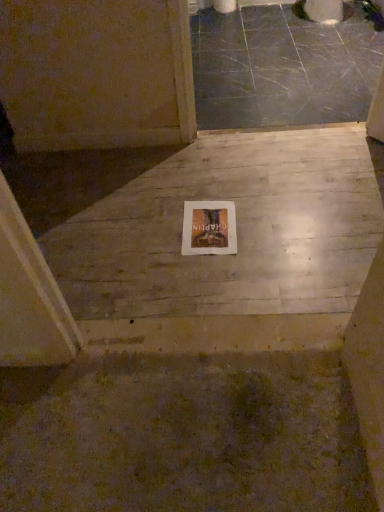
This screenshot has width=384, height=512. What are the coordinates of `white wood floor at center, positioned as the 2th concrete in top-to-bottom order` in the screenshot? It's located at (227, 255).

Identify the location of wooden book at center. (209, 228).

Which object is closer to the camera, wooden book at center or white wood floor at center, which is the 2th concrete from back to front?

white wood floor at center, which is the 2th concrete from back to front, is in front.

Considering the relative sizes of wooden book at center and white wood floor at center, the first concrete from the bottom, in the image provided, is wooden book at center smaller than white wood floor at center, the first concrete from the bottom,?

Yes, wooden book at center is smaller than white wood floor at center, the first concrete from the bottom.

Based on the photo, are wooden book at center and white wood floor at center, the first concrete from the bottom, located far from each other?

No, wooden book at center is in close proximity to white wood floor at center, the first concrete from the bottom.

Considering the relative sizes of wooden book at center and white wood floor at center, the first concrete from the bottom, in the image provided, is wooden book at center shorter than white wood floor at center, the first concrete from the bottom,?

Yes.

Is white wood floor at center, which is the 2th concrete from back to front, to the right of gray polished concrete at upper center, which is counted as the first concrete, starting from the top, from the viewer's perspective?

In fact, white wood floor at center, which is the 2th concrete from back to front, is to the left of gray polished concrete at upper center, which is counted as the first concrete, starting from the top.

Who is shorter, white wood floor at center, which is the first concrete from front to back, or gray polished concrete at upper center, the 2th concrete when ordered from bottom to top?

Standing shorter between the two is gray polished concrete at upper center, the 2th concrete when ordered from bottom to top.

Looking at this image, are wooden book at center and gray polished concrete at upper center, which is counted as the 2th concrete, starting from the front, making contact?

No.

Find the location of a particular element. concrete above the wooden book at center (from a real-world perspective) is located at coordinates (282, 67).

Considering the points (214, 239) and (216, 74), which point is in front, point (214, 239) or point (216, 74)?

The point (214, 239) is closer to the camera.

Could you tell me if gray polished concrete at upper center, which is counted as the 2th concrete, starting from the front, is facing white wood floor at center, positioned as the 2th concrete in top-to-bottom order?

No, gray polished concrete at upper center, which is counted as the 2th concrete, starting from the front, is not aimed at white wood floor at center, positioned as the 2th concrete in top-to-bottom order.

Is gray polished concrete at upper center, the 1th concrete from the back, completely or partially outside of white wood floor at center, the first concrete from the bottom?

gray polished concrete at upper center, the 1th concrete from the back, is positioned outside white wood floor at center, the first concrete from the bottom.

Considering the positions of objects gray polished concrete at upper center, the 2th concrete when ordered from bottom to top, and white wood floor at center, the first concrete from the bottom, in the image provided, who is more to the right, gray polished concrete at upper center, the 2th concrete when ordered from bottom to top, or white wood floor at center, the first concrete from the bottom,?

Positioned to the right is gray polished concrete at upper center, the 2th concrete when ordered from bottom to top.

Is white wood floor at center, which is the first concrete from front to back, next to wooden book at center?

There is a gap between white wood floor at center, which is the first concrete from front to back, and wooden book at center.

In the scene shown: Between white wood floor at center, the first concrete from the bottom, and wooden book at center, which one has smaller width?

With smaller width is wooden book at center.

Is wooden book at center located within white wood floor at center, which is the first concrete from front to back?

Yes, wooden book at center is surrounded by white wood floor at center, which is the first concrete from front to back.

Would you say white wood floor at center, which is the 2th concrete from back to front, is to the left or to the right of wooden book at center in the picture?

white wood floor at center, which is the 2th concrete from back to front, is to the left of wooden book at center.

Does gray polished concrete at upper center, the 1th concrete from the back, have a greater height compared to wooden book at center?

Yes.

Considering the sizes of gray polished concrete at upper center, the 1th concrete from the back, and wooden book at center in the image, is gray polished concrete at upper center, the 1th concrete from the back, wider or thinner than wooden book at center?

Considering their sizes, gray polished concrete at upper center, the 1th concrete from the back, looks broader than wooden book at center.

Is gray polished concrete at upper center, the 1th concrete from the back, oriented towards wooden book at center?

Yes, gray polished concrete at upper center, the 1th concrete from the back, is facing wooden book at center.

Find the location of a particular element. picture frame located behind the white wood floor at center, which is the 2th concrete from back to front is located at coordinates (209, 228).

Where is `concrete on the left of gray polished concrete at upper center, which is counted as the 2th concrete, starting from the front`? concrete on the left of gray polished concrete at upper center, which is counted as the 2th concrete, starting from the front is located at coordinates (227, 255).

Based on their spatial positions, is white wood floor at center, positioned as the 2th concrete in top-to-bottom order, or wooden book at center closer to gray polished concrete at upper center, the 1th concrete from the back?

The object closer to gray polished concrete at upper center, the 1th concrete from the back, is white wood floor at center, positioned as the 2th concrete in top-to-bottom order.

Which object lies nearer to the anchor point wooden book at center, gray polished concrete at upper center, the 1th concrete from the back, or white wood floor at center, which is the 2th concrete from back to front?

Among the two, white wood floor at center, which is the 2th concrete from back to front, is located nearer to wooden book at center.

Estimate the real-world distances between objects in this image. Which object is further from wooden book at center, white wood floor at center, the first concrete from the bottom, or gray polished concrete at upper center, which is counted as the 2th concrete, starting from the front?

gray polished concrete at upper center, which is counted as the 2th concrete, starting from the front, is further to wooden book at center.

Looking at the image, which one is located closer to white wood floor at center, the first concrete from the bottom, wooden book at center or gray polished concrete at upper center, which is counted as the first concrete, starting from the top?

wooden book at center is positioned closer to the anchor white wood floor at center, the first concrete from the bottom.

Which object lies nearer to the anchor point gray polished concrete at upper center, which is counted as the first concrete, starting from the top, wooden book at center or white wood floor at center, the first concrete from the bottom?

Based on the image, white wood floor at center, the first concrete from the bottom, appears to be nearer to gray polished concrete at upper center, which is counted as the first concrete, starting from the top.

When comparing their distances from white wood floor at center, positioned as the 2th concrete in top-to-bottom order, does gray polished concrete at upper center, the 1th concrete from the back, or wooden book at center seem closer?

Based on the image, wooden book at center appears to be nearer to white wood floor at center, positioned as the 2th concrete in top-to-bottom order.

Where is `concrete between gray polished concrete at upper center, which is counted as the 2th concrete, starting from the front, and wooden book at center from top to bottom`? This screenshot has height=512, width=384. concrete between gray polished concrete at upper center, which is counted as the 2th concrete, starting from the front, and wooden book at center from top to bottom is located at coordinates (227, 255).